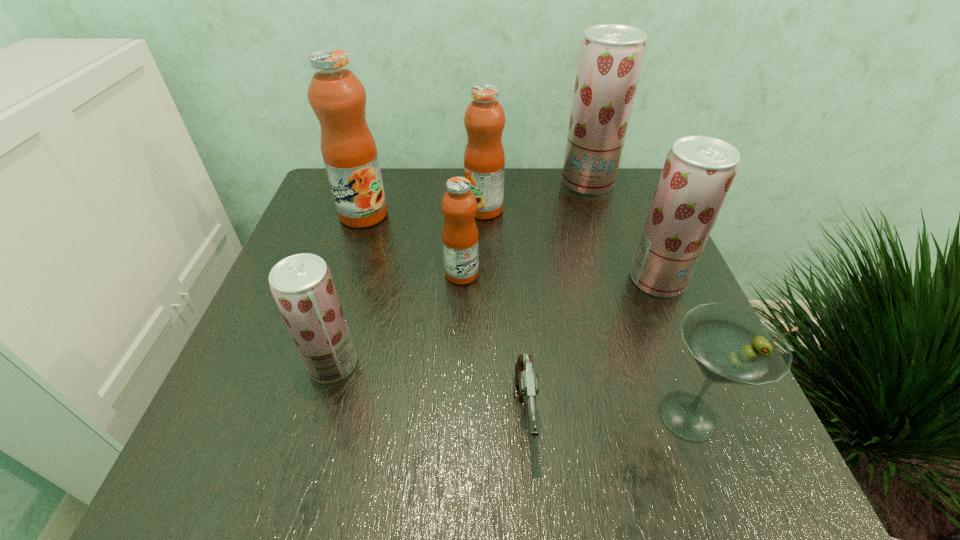
Locate an element on the screen. Image resolution: width=960 pixels, height=540 pixels. pistol is located at coordinates (527, 379).

The height and width of the screenshot is (540, 960). I want to click on free space located 0.140m on the front of the farthest object, so click(x=603, y=231).

Where is `vacant space located on the front label of the biggest orange fruit juice`? The height and width of the screenshot is (540, 960). vacant space located on the front label of the biggest orange fruit juice is located at coordinates (337, 296).

The width and height of the screenshot is (960, 540). Identify the location of blank space located 0.190m on the back of the second farthest strawberry fruit juice. (629, 211).

I want to click on vacant point located on the front label of the second biggest orange fruit juice, so coord(346,210).

I want to click on free space located 0.090m on the front label of the second biggest orange fruit juice, so click(x=429, y=210).

Identify the location of vacant region located on the front label of the second biggest orange fruit juice. Image resolution: width=960 pixels, height=540 pixels. (358, 210).

At what (x,y) coordinates should I click in order to perform the action: click on vacant region located 0.140m on the back of the smallest strawberry fruit juice. Please return your answer as a coordinate pair (x, y). The width and height of the screenshot is (960, 540). Looking at the image, I should click on (354, 290).

Where is `vacant space situated 0.120m on the front label of the nearest orange fruit juice`? The width and height of the screenshot is (960, 540). vacant space situated 0.120m on the front label of the nearest orange fruit juice is located at coordinates (535, 274).

Image resolution: width=960 pixels, height=540 pixels. I want to click on vacant space located 0.220m on the left of the martini, so click(x=507, y=416).